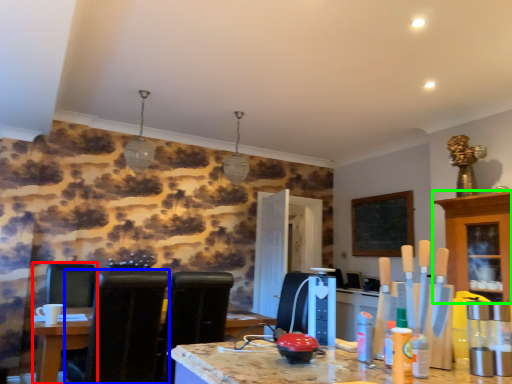
Question: Which object is the farthest from chair (highlighted by a red box)? Choose among these: chair (highlighted by a blue box) or cabinetry (highlighted by a green box).

Choices:
 (A) chair
 (B) cabinetry

Answer: (B)